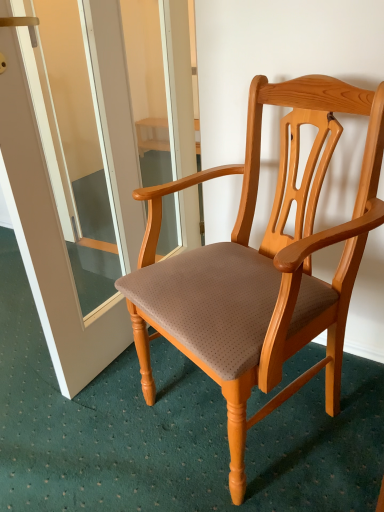
Question: From a real-world perspective, relative to light brown wood chair at center, is transparent glass screen door at center vertically above or below?

Choices:
 (A) above
 (B) below

Answer: (A)

Question: Is transparent glass screen door at center wider or thinner than light brown wood chair at center?

Choices:
 (A) wide
 (B) thin

Answer: (B)

Question: Is transparent glass screen door at center bigger or smaller than light brown wood chair at center?

Choices:
 (A) big
 (B) small

Answer: (B)

Question: Does point (329, 290) appear closer or farther from the camera than point (8, 175)?

Choices:
 (A) farther
 (B) closer

Answer: (B)

Question: Looking at their shapes, would you say light brown wood chair at center is wider or thinner than transparent glass screen door at center?

Choices:
 (A) wide
 (B) thin

Answer: (A)

Question: Is light brown wood chair at center to the left or to the right of transparent glass screen door at center in the image?

Choices:
 (A) left
 (B) right

Answer: (B)

Question: From the image's perspective, is light brown wood chair at center located above or below transparent glass screen door at center?

Choices:
 (A) above
 (B) below

Answer: (B)